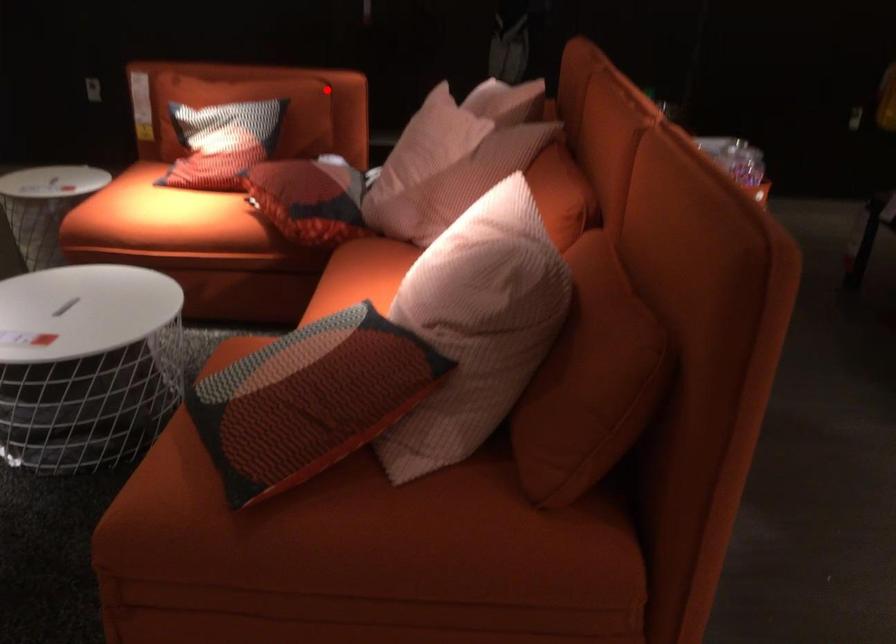
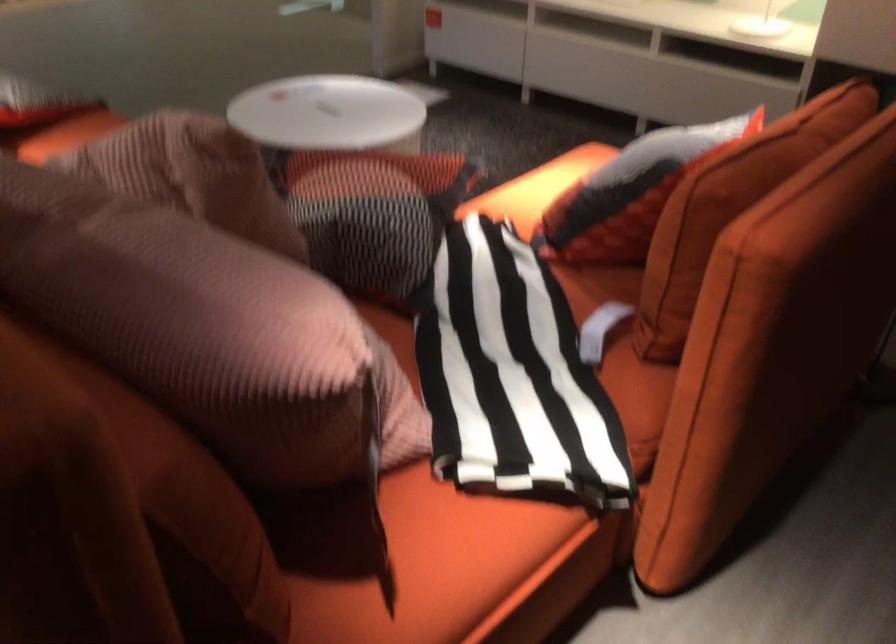
Question: I am providing you with two images of the same scene from different viewpoints. Image1 has a red point marked. In image2, the corresponding 3D location appears at what relative position? Reply with the corresponding letter.

Choices:
 (A) Closer
 (B) Farther

Answer: (A)